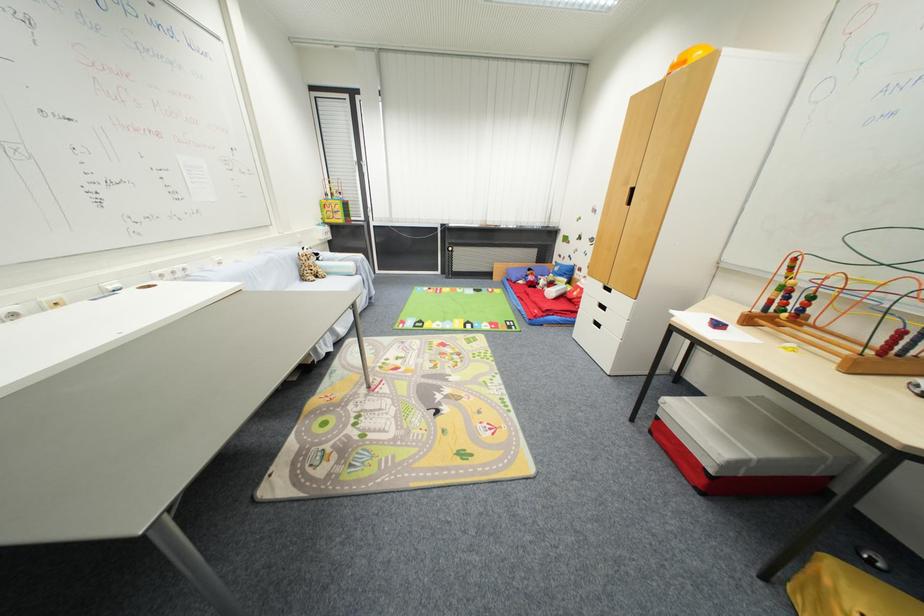
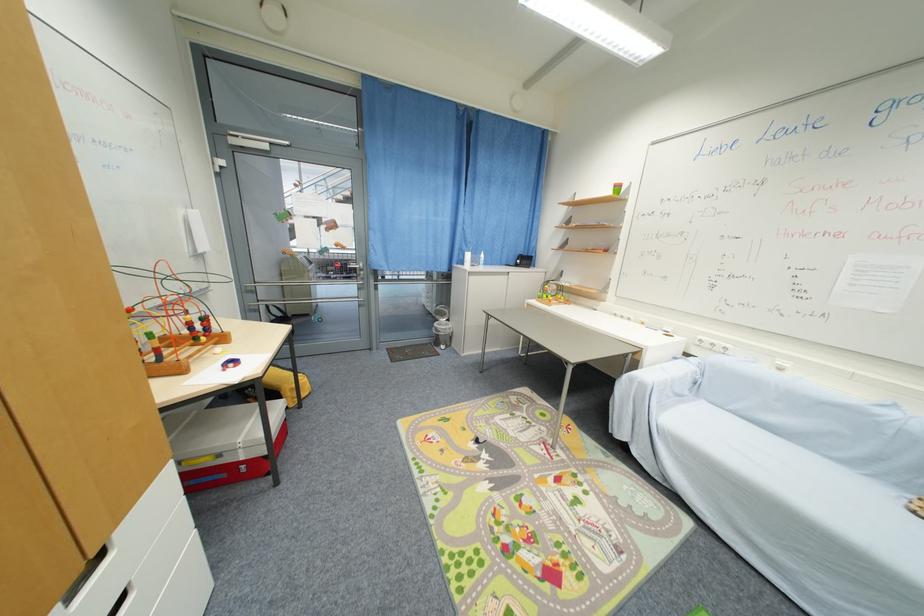
Where in the second image is the point corresponding to the point at 185,276 from the first image?

(723, 351)